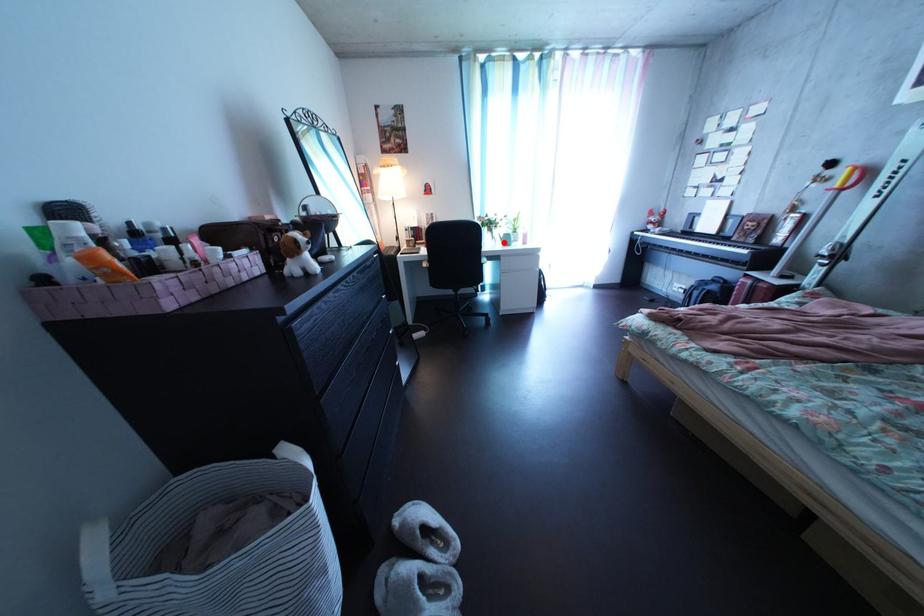
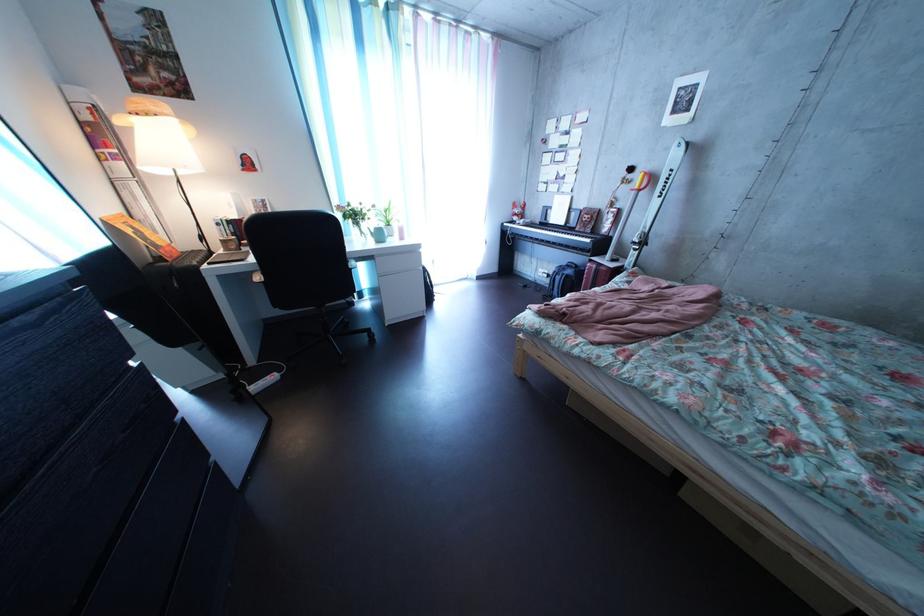
Question: I am providing you with two images of the same scene from different viewpoints. Given a red point in image1, look at the same physical point in image2. Is it:

Choices:
 (A) Closer to the viewpoint
 (B) Farther from the viewpoint

Answer: (B)